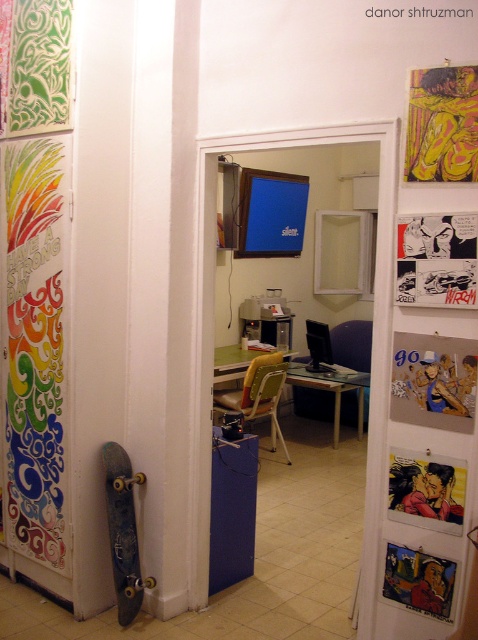
You are an artist standing in the room and want to place a new poster on the wall. The poster needs to be placed exactly at the point where the comic book page at upper right is currently located. Can you determine the coordinates of that point?

The comic book page at upper right is located at point (x=436, y=260), so you should place the new poster at those coordinates.

You are standing in the room and want to reach the comic book page at upper right. Given that the average person can reach up to 6 feet without a stool, can you reach it?

The comic book page at upper right is 6.89 feet away from the viewer, which is beyond the average person reach of 6 feet. You will need a stool to reach it.

You are an interior designer planning to hang a new painting in this room. You notice the yellow textured fabric at upper right and the oil painting portrait at center. Which object is located above the other?

The yellow textured fabric at upper right is positioned over the oil painting portrait at center, meaning it is above the portrait.